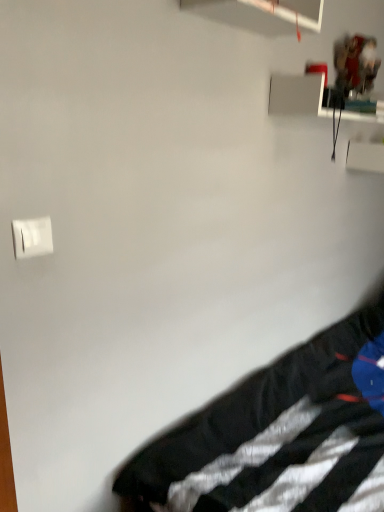
Question: Considering the positions of black fabric at lower right and white plastic light switch at upper left in the image, is black fabric at lower right bigger or smaller than white plastic light switch at upper left?

Choices:
 (A) small
 (B) big

Answer: (B)

Question: Considering their positions, is black fabric at lower right located in front of or behind white plastic light switch at upper left?

Choices:
 (A) behind
 (B) front

Answer: (B)

Question: Is black fabric at lower right to the left or to the right of white plastic light switch at upper left in the image?

Choices:
 (A) left
 (B) right

Answer: (B)

Question: Is point (24, 251) positioned closer to the camera than point (243, 443)?

Choices:
 (A) closer
 (B) farther

Answer: (A)

Question: Considering the positions of white plastic light switch at upper left and black fabric at lower right in the image, is white plastic light switch at upper left wider or thinner than black fabric at lower right?

Choices:
 (A) wide
 (B) thin

Answer: (B)

Question: In the image, is white plastic light switch at upper left on the left side or the right side of black fabric at lower right?

Choices:
 (A) left
 (B) right

Answer: (A)

Question: From the image's perspective, is white plastic light switch at upper left located above or below black fabric at lower right?

Choices:
 (A) below
 (B) above

Answer: (B)